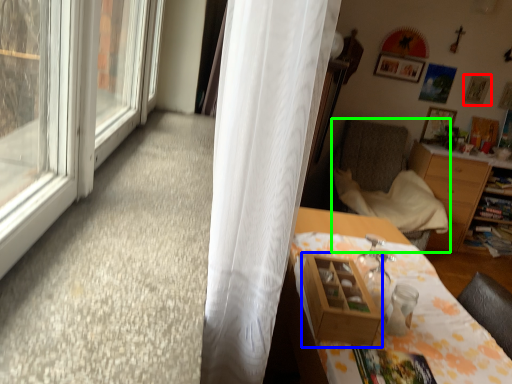
Question: Considering the real-world distances, which object is closest to picture frame (highlighted by a red box)? shelf (highlighted by a blue box) or chair (highlighted by a green box).

Choices:
 (A) shelf
 (B) chair

Answer: (B)